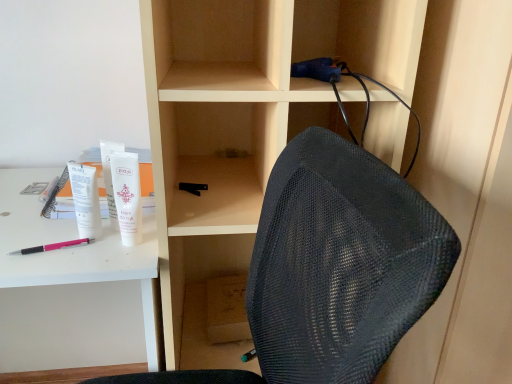
This screenshot has height=384, width=512. What are the coordinates of `white matte tube at upper left, marked as the 4th stationery in a top-to-bottom arrangement` in the screenshot? It's located at (85, 200).

The width and height of the screenshot is (512, 384). What do you see at coordinates (110, 177) in the screenshot?
I see `white matte tube at upper left, which is the second stationery in left-to-right order` at bounding box center [110, 177].

This screenshot has height=384, width=512. Describe the element at coordinates (252, 91) in the screenshot. I see `matte wood cabinet at center` at that location.

In order to face pink plastic pen at lower left, should I rotate leftwards or rightwards?

Turn left approximately 25.561 degrees to face it.

What do you see at coordinates (52, 246) in the screenshot?
I see `pink plastic pen at lower left` at bounding box center [52, 246].

Find the location of `black plastic ruler at center, positioned as the 3th stationery in left-to-right order`. black plastic ruler at center, positioned as the 3th stationery in left-to-right order is located at coordinates (193, 187).

You are a GUI agent. You are given a task and a screenshot of the screen. Output one action in this format:
    pyautogui.click(x=<x>, y=<y>)
    Task: Click on the stationery that is the 3rd object located behind the white plastic desk at upper left
    
    Given the screenshot: What is the action you would take?
    pyautogui.click(x=110, y=177)

Which of these two, white matte tube at upper left, which is the second stationery in left-to-right order, or white plastic desk at upper left, stands taller?

Standing taller between the two is white plastic desk at upper left.

From a real-world perspective, which object stands above the other?

white matte tube at upper left, the 3th stationery positioned from the bottom, from a real-world perspective.

From the image's perspective, would you say white matte tube at upper left, the 3th stationery positioned from the bottom, is shown under white plastic desk at upper left?

Incorrect, from the image's perspective, white matte tube at upper left, the 3th stationery positioned from the bottom, is higher than white plastic desk at upper left.

Looking at their sizes, would you say white matte tube at upper left, marked as the 4th stationery in a top-to-bottom arrangement, is wider or thinner than white matte tube at upper left, which is the second stationery in left-to-right order?

Clearly, white matte tube at upper left, marked as the 4th stationery in a top-to-bottom arrangement, has more width compared to white matte tube at upper left, which is the second stationery in left-to-right order.

Considering the relative positions of white matte tube at upper left, marked as the 4th stationery in a top-to-bottom arrangement, and white matte tube at upper left, which is the second stationery in left-to-right order, in the image provided, is white matte tube at upper left, marked as the 4th stationery in a top-to-bottom arrangement, to the right of white matte tube at upper left, which is the second stationery in left-to-right order, from the viewer's perspective?

No.

This screenshot has width=512, height=384. Find the location of `stationery that is the 2nd one when counting upward from the white matte tube at upper left, positioned as the first stationery in left-to-right order (from the image's perspective)`. stationery that is the 2nd one when counting upward from the white matte tube at upper left, positioned as the first stationery in left-to-right order (from the image's perspective) is located at coordinates (110, 177).

In the scene shown: Is white matte tube at upper left, positioned as the first stationery in left-to-right order, taller or shorter than white matte tube at upper left, the second stationery positioned from the top?

In the image, white matte tube at upper left, positioned as the first stationery in left-to-right order, appears to be shorter than white matte tube at upper left, the second stationery positioned from the top.

You are a GUI agent. You are given a task and a screenshot of the screen. Output one action in this format:
    pyautogui.click(x=<x>, y=<y>)
    Task: Click on the stationery in front of the white matte tube at upper left, the 4th stationery positioned from the right
    
    Given the screenshot: What is the action you would take?
    pyautogui.click(x=317, y=70)

In the scene shown: Considering the relative sizes of blue fabric cable at upper center, the first stationery from the right, and white matte tube at upper left, the 4th stationery positioned from the right, in the image provided, is blue fabric cable at upper center, the first stationery from the right, bigger than white matte tube at upper left, the 4th stationery positioned from the right,?

Yes.

Is blue fabric cable at upper center, the 4th stationery when ordered from bottom to top, taller or shorter than white matte tube at upper left, the 4th stationery positioned from the right?

Considering their sizes, blue fabric cable at upper center, the 4th stationery when ordered from bottom to top, has less height than white matte tube at upper left, the 4th stationery positioned from the right.

Which object is positioned more to the left, white matte tube at upper left, the 1th stationery ordered from the bottom, or pink plastic pen at lower left?

pink plastic pen at lower left is more to the left.

How many degrees apart are the facing directions of white matte tube at upper left, marked as the 4th stationery in a top-to-bottom arrangement, and pink plastic pen at lower left?

The angular difference between white matte tube at upper left, marked as the 4th stationery in a top-to-bottom arrangement, and pink plastic pen at lower left is 38.1 degrees.

Is white matte tube at upper left, the 4th stationery positioned from the right, thinner than pink plastic pen at lower left?

No.

Consider the image. Is white matte tube at upper left, the 1th stationery ordered from the bottom, further to the viewer compared to pink plastic pen at lower left?

That is False.

Does pink plastic pen at lower left contain white matte tube at upper left?

No, white matte tube at upper left is not a part of pink plastic pen at lower left.

Is pink plastic pen at lower left not close to white matte tube at upper left?

pink plastic pen at lower left is near white matte tube at upper left, not far away.

Between point (30, 249) and point (136, 182), which one is positioned in front?

The point (136, 182) is more forward.

From the picture: How distant is pink plastic pen at lower left from white matte tube at upper left?

pink plastic pen at lower left and white matte tube at upper left are 4.54 inches apart from each other.

Looking at this image, from the image's perspective, is blue fabric cable at upper center, the first stationery from the right, under pink plastic pen at lower left?

No, from the image's perspective, blue fabric cable at upper center, the first stationery from the right, is not below pink plastic pen at lower left.

Starting from the pink plastic pen at lower left, which stationery is the 4th one to the right? Please provide its 2D coordinates.

[(317, 70)]

Is blue fabric cable at upper center, acting as the 4th stationery starting from the left, in front of or behind pink plastic pen at lower left in the image?

In the image, blue fabric cable at upper center, acting as the 4th stationery starting from the left, appears in front of pink plastic pen at lower left.

Is pink plastic pen at lower left smaller than white matte tube at upper left, marked as the 4th stationery in a top-to-bottom arrangement?

Correct, pink plastic pen at lower left occupies less space than white matte tube at upper left, marked as the 4th stationery in a top-to-bottom arrangement.

Is pink plastic pen at lower left facing away from white matte tube at upper left, marked as the 4th stationery in a top-to-bottom arrangement?

pink plastic pen at lower left does not have its back to white matte tube at upper left, marked as the 4th stationery in a top-to-bottom arrangement.

Does pink plastic pen at lower left have a lesser height compared to white matte tube at upper left, marked as the 4th stationery in a top-to-bottom arrangement?

Indeed, pink plastic pen at lower left has a lesser height compared to white matte tube at upper left, marked as the 4th stationery in a top-to-bottom arrangement.

From a real-world perspective, is pink plastic pen at lower left on top of white matte tube at upper left, the 4th stationery positioned from the right?

No, from a real-world perspective, pink plastic pen at lower left is not on top of white matte tube at upper left, the 4th stationery positioned from the right.

Identify the location of the 3rd stationery above the white plastic desk at upper left (from the image's perspective). This screenshot has width=512, height=384. (x=110, y=177).

Where is `stationery on the left of white matte tube at upper left, which is the 3th stationery in right-to-left order`? This screenshot has height=384, width=512. stationery on the left of white matte tube at upper left, which is the 3th stationery in right-to-left order is located at coordinates (85, 200).

From the picture: Based on their spatial positions, is white matte tube at upper left or black plastic ruler at center, the third stationery when ordered from top to bottom, closer to blue fabric cable at upper center, the 4th stationery when ordered from bottom to top?

black plastic ruler at center, the third stationery when ordered from top to bottom.

Considering their positions, is black plastic ruler at center, which is the 2th stationery in bottom-to-top order, positioned closer to white plastic desk at upper left than blue fabric cable at upper center, the 4th stationery when ordered from bottom to top?

black plastic ruler at center, which is the 2th stationery in bottom-to-top order, is closer to white plastic desk at upper left.

Looking at the image, which one is located closer to matte wood cabinet at center, white matte tube at upper left or white matte tube at upper left, the 4th stationery positioned from the right?

Among the two, white matte tube at upper left is located nearer to matte wood cabinet at center.

Based on their spatial positions, is white matte tube at upper left, marked as the 4th stationery in a top-to-bottom arrangement, or black plastic ruler at center, positioned as the 3th stationery in left-to-right order, closer to blue fabric cable at upper center, arranged as the first stationery when viewed from the top?

black plastic ruler at center, positioned as the 3th stationery in left-to-right order, lies closer to blue fabric cable at upper center, arranged as the first stationery when viewed from the top, than the other object.

Which object lies nearer to the anchor point white matte tube at upper left, marked as the 4th stationery in a top-to-bottom arrangement, white plastic desk at upper left or matte wood cabinet at center?

white plastic desk at upper left is positioned closer to the anchor white matte tube at upper left, marked as the 4th stationery in a top-to-bottom arrangement.

Considering their positions, is white matte tube at upper left, the second stationery positioned from the top, positioned further to white matte tube at upper left, marked as the 4th stationery in a top-to-bottom arrangement, than white matte tube at upper left?

Based on the image, white matte tube at upper left appears to be further to white matte tube at upper left, marked as the 4th stationery in a top-to-bottom arrangement.

From the image, which object appears to be farther from white plastic desk at upper left, white matte tube at upper left or matte wood cabinet at center?

matte wood cabinet at center.

Considering their positions, is matte wood cabinet at center positioned closer to black plastic ruler at center, positioned as the 3th stationery in left-to-right order, than white matte tube at upper left?

Based on the image, white matte tube at upper left appears to be nearer to black plastic ruler at center, positioned as the 3th stationery in left-to-right order.

Where is `stationery that lies between black plastic ruler at center, the third stationery when ordered from top to bottom, and white plastic desk at upper left from top to bottom`? stationery that lies between black plastic ruler at center, the third stationery when ordered from top to bottom, and white plastic desk at upper left from top to bottom is located at coordinates (85, 200).

This screenshot has height=384, width=512. In order to click on stationery between white matte tube at upper left and white plastic desk at upper left vertically in this screenshot , I will do `click(85, 200)`.

Where is `toiletry between blue fabric cable at upper center, the first stationery from the right, and white plastic desk at upper left, in the vertical direction`? The height and width of the screenshot is (384, 512). toiletry between blue fabric cable at upper center, the first stationery from the right, and white plastic desk at upper left, in the vertical direction is located at coordinates (127, 195).

At what (x,y) coordinates should I click in order to perform the action: click on toiletry between black plastic ruler at center, the third stationery when ordered from top to bottom, and white plastic desk at upper left from top to bottom. Please return your answer as a coordinate pair (x, y). The width and height of the screenshot is (512, 384). Looking at the image, I should click on (127, 195).